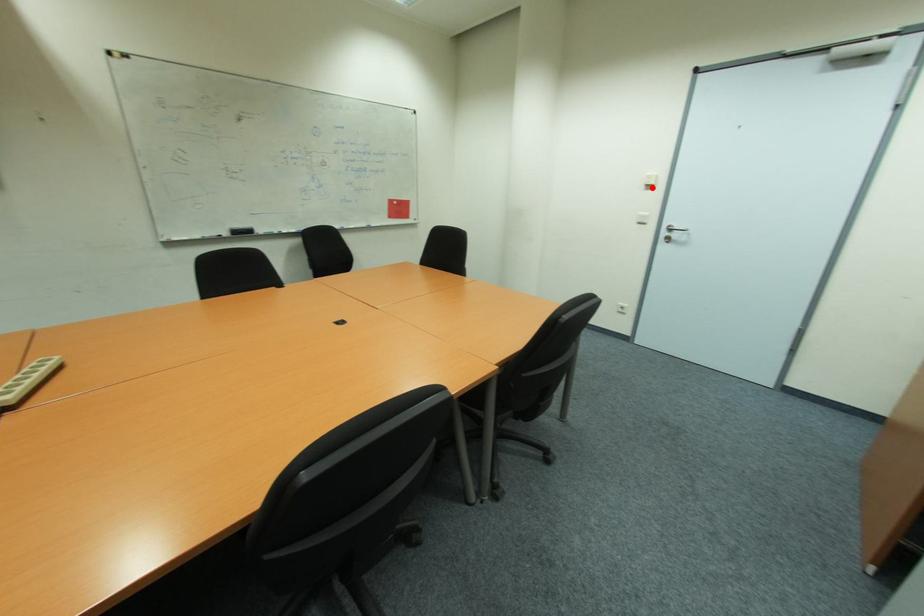
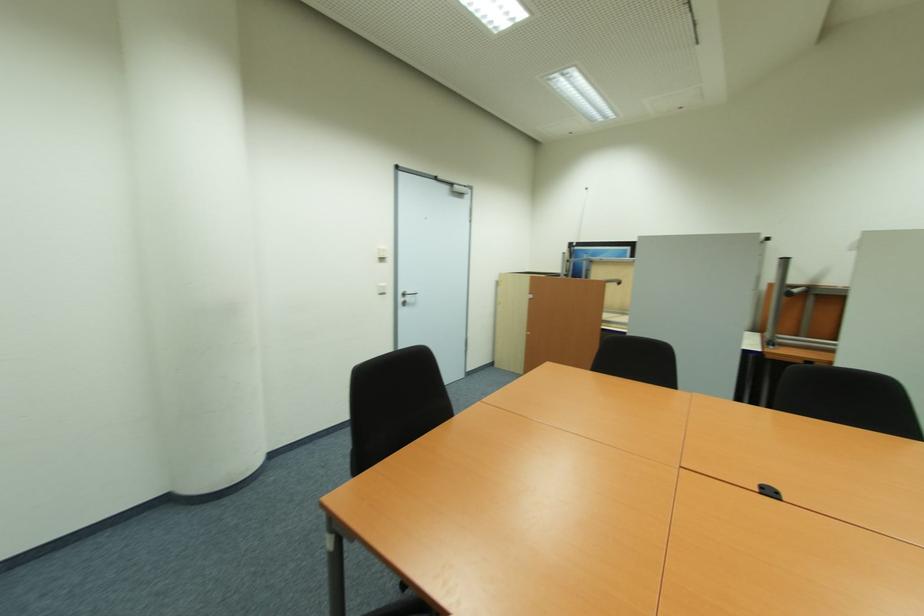
Question: I am providing you with two images of the same scene from different viewpoints. A red point is shown in image1. For the corresponding object point in image2, is it positioned nearer or farther from the camera?

Choices:
 (A) Nearer
 (B) Farther

Answer: (B)